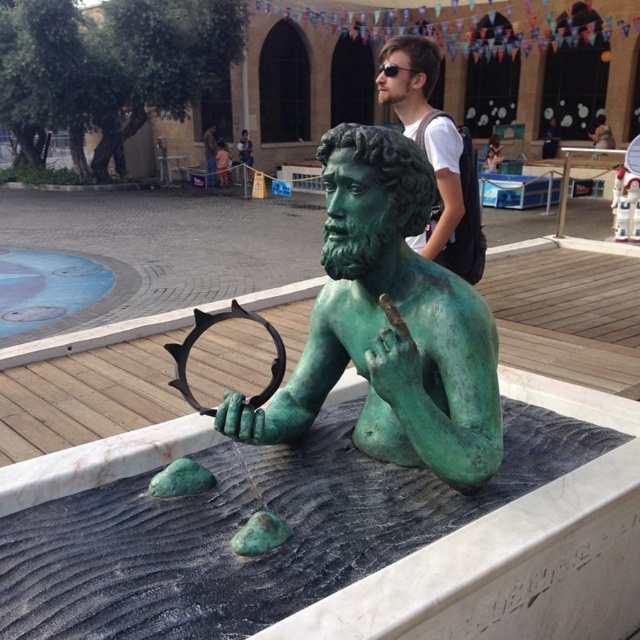
Can you confirm if green patina bronze statue at center is positioned to the right of matte green statue at upper center?

Incorrect, green patina bronze statue at center is not on the right side of matte green statue at upper center.

Can you confirm if green patina bronze statue at center is taller than matte green statue at upper center?

In fact, green patina bronze statue at center may be shorter than matte green statue at upper center.

Does point (260, 440) come behind point (426, 51)?

No, it is not.

The width and height of the screenshot is (640, 640). I want to click on green patina bronze statue at center, so click(388, 324).

Is green patina bronze statue at center to the right of matte green statue at center from the viewer's perspective?

Yes, green patina bronze statue at center is to the right of matte green statue at center.

Can you confirm if green patina bronze statue at center is wider than matte green statue at center?

Yes.

I want to click on green patina bronze statue at center, so click(388, 324).

Does matte green statue at upper center have a larger size compared to matte green statue at center?

No, matte green statue at upper center is not bigger than matte green statue at center.

Can you confirm if matte green statue at upper center is smaller than matte green statue at center?

Yes, matte green statue at upper center is smaller than matte green statue at center.

Does point (465, 278) lie in front of point (208, 164)?

Yes, it is in front of point (208, 164).

The image size is (640, 640). In order to click on matte green statue at upper center in this screenshot , I will do `click(435, 154)`.